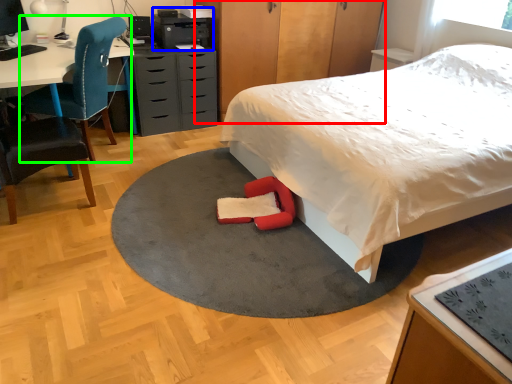
Question: Which object is positioned farthest from dresser (highlighted by a red box)? Select from printer (highlighted by a blue box) and chair (highlighted by a green box).

Choices:
 (A) printer
 (B) chair

Answer: (B)